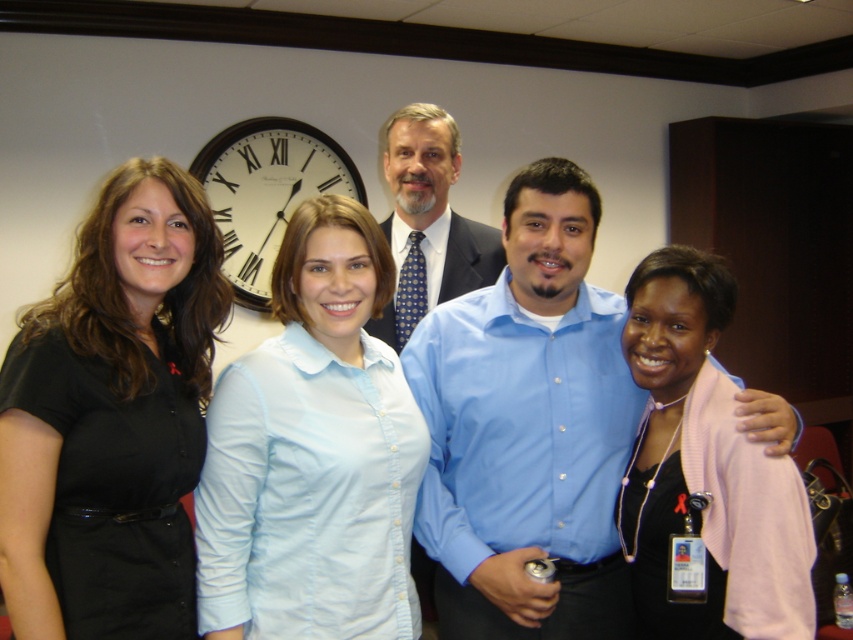
You are a photographer trying to adjust the lighting for a group photo. You notice the pink fabric shirt at center and the blue shirt at center. Which shirt should you focus on first to ensure proper exposure, considering their positions relative to the light source?

The pink fabric shirt at center is in front of the blue shirt at center, so you should focus on the pink fabric shirt at center first to ensure proper exposure since it is closer to the light source.